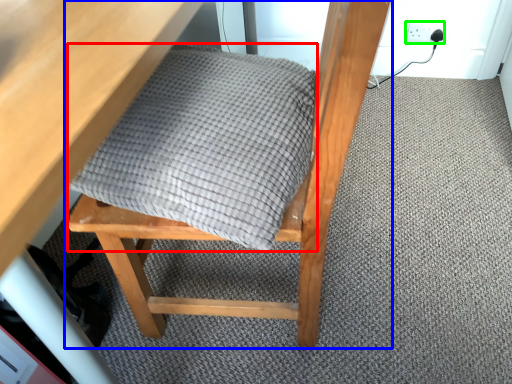
Question: Estimate the real-world distances between objects in this image. Which object is farther from blanket (highlighted by a red box), chair (highlighted by a blue box) or electric outlet (highlighted by a green box)?

Choices:
 (A) chair
 (B) electric outlet

Answer: (B)